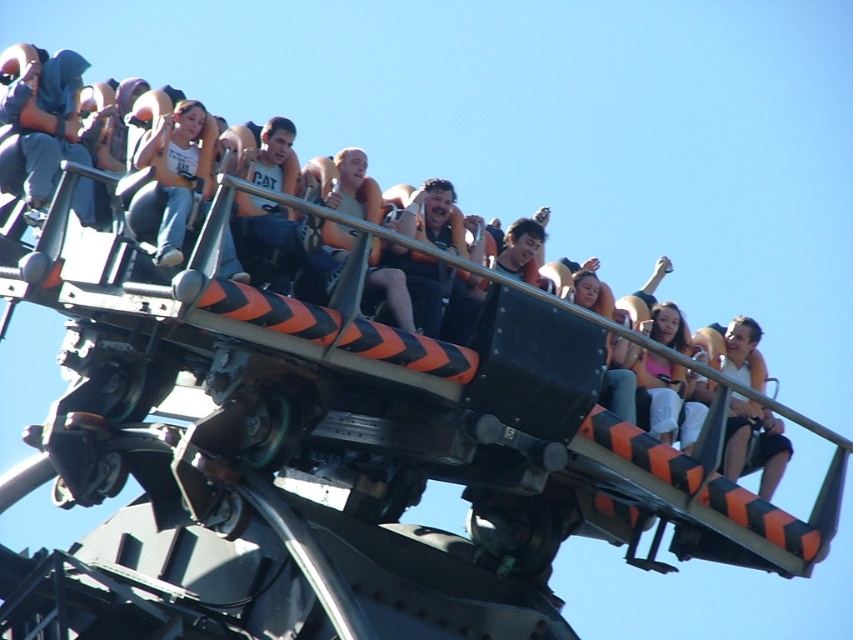
Who is lower down, white matte shirt at upper right or pink fabric at center?

white matte shirt at upper right is lower down.

Based on the photo, can you confirm if white matte shirt at upper right is positioned above pink fabric at center?

Incorrect, white matte shirt at upper right is not positioned above pink fabric at center.

Does point (764, 408) lie in front of point (670, 401)?

No, it is behind (670, 401).

Where is `white matte shirt at upper right`? white matte shirt at upper right is located at coordinates (755, 444).

Does point (254, 152) lie in front of point (325, 227)?

No, (254, 152) is further to viewer.

Between point (247, 177) and point (396, 282), which one is positioned in front?

Positioned in front is point (396, 282).

I want to click on matte orange vest at center, so click(267, 241).

Is white matte shirt at upper right taller than matte orange safety harness at upper center?

No, white matte shirt at upper right is not taller than matte orange safety harness at upper center.

In the scene shown: Is white matte shirt at upper right positioned behind matte orange safety harness at upper center?

Yes, it is.

Who is more distant from viewer, (724, 440) or (32, 84)?

Point (32, 84)

This screenshot has width=853, height=640. Find the location of `white matte shirt at upper right`. white matte shirt at upper right is located at coordinates (755, 444).